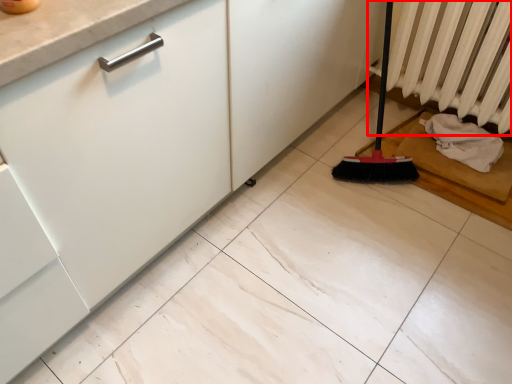
Question: From the image's perspective, what is the correct spatial relationship of radiator (annotated by the red box) in relation to material?

Choices:
 (A) below
 (B) above

Answer: (B)